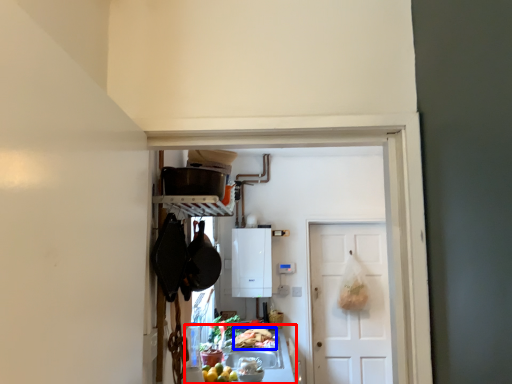
Question: Which object is further to the camera taking this photo, counter top (highlighted by a red box) or food (highlighted by a blue box)?

Choices:
 (A) counter top
 (B) food

Answer: (B)